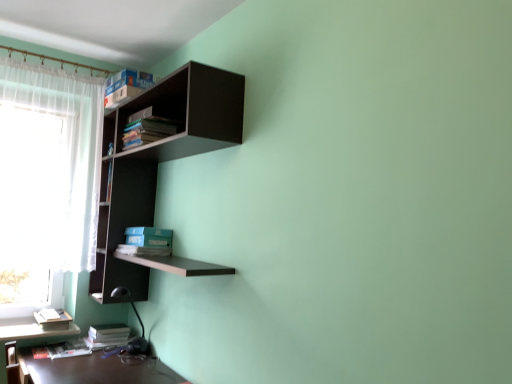
Locate an element on the screen. This screenshot has width=512, height=384. blank space situated above hardcover book at lower left, the fifth book viewed from the top (from a real-world perspective) is located at coordinates (63, 346).